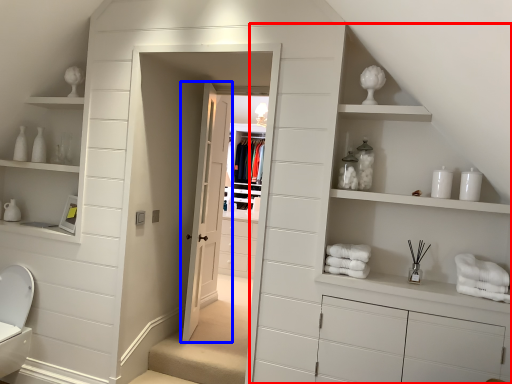
Question: Among these objects, which one is nearest to the camera, dresser (highlighted by a red box) or door (highlighted by a blue box)?

Choices:
 (A) dresser
 (B) door

Answer: (A)